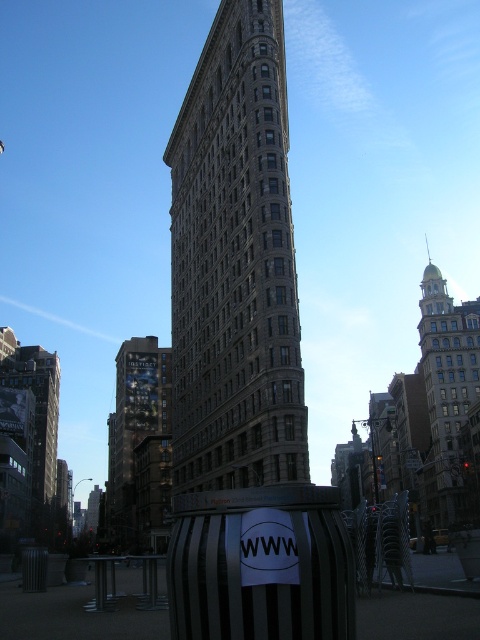
Question: Is reflective glass building at center below dark gray stone building at left?

Choices:
 (A) no
 (B) yes

Answer: (B)

Question: Can you confirm if reflective glass building at center is smaller than dark gray stone building at left?

Choices:
 (A) no
 (B) yes

Answer: (B)

Question: Among these points, which one is nearest to the camera?

Choices:
 (A) (14, 509)
 (B) (226, 76)
 (C) (145, 390)
 (D) (445, 458)

Answer: (B)

Question: Which object is the farthest from the reflective glass building at center?

Choices:
 (A) dark gray stone building at left
 (B) gold/golden stone tower at right

Answer: (B)

Question: Which of the following is the closest to the observer?

Choices:
 (A) (108, 422)
 (B) (247, 262)
 (C) (451, 518)

Answer: (B)

Question: Can you confirm if reflective glass building at center is positioned to the right of dark gray stone building at left?

Choices:
 (A) no
 (B) yes

Answer: (B)